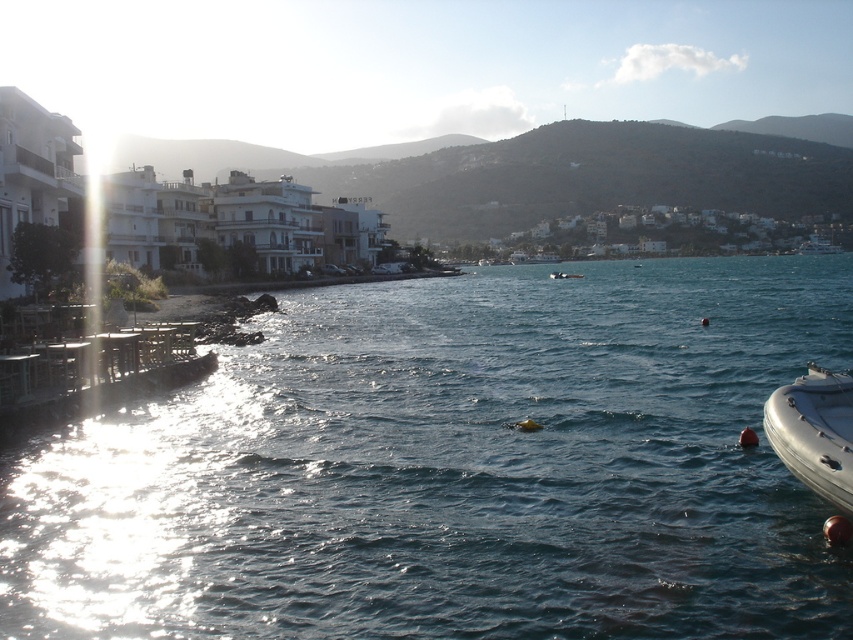
Question: Does clear blue water at center appear on the right side of silver metallic dinghy at lower right?

Choices:
 (A) yes
 (B) no

Answer: (A)

Question: Which of the following is the closest to the observer?

Choices:
 (A) (619, 387)
 (B) (821, 390)
 (C) (575, 273)

Answer: (B)

Question: Which point is closer to the camera?

Choices:
 (A) [816, 444]
 (B) [561, 272]

Answer: (A)

Question: Among these objects, which one is farthest from the camera?

Choices:
 (A) clear blue water at center
 (B) silver metallic dinghy at lower right
 (C) white rubber boat at center

Answer: (C)

Question: Does silver metallic dinghy at lower right have a lesser width compared to white rubber boat at center?

Choices:
 (A) yes
 (B) no

Answer: (A)

Question: Does silver metallic dinghy at lower right have a lesser width compared to white rubber boat at center?

Choices:
 (A) yes
 (B) no

Answer: (A)